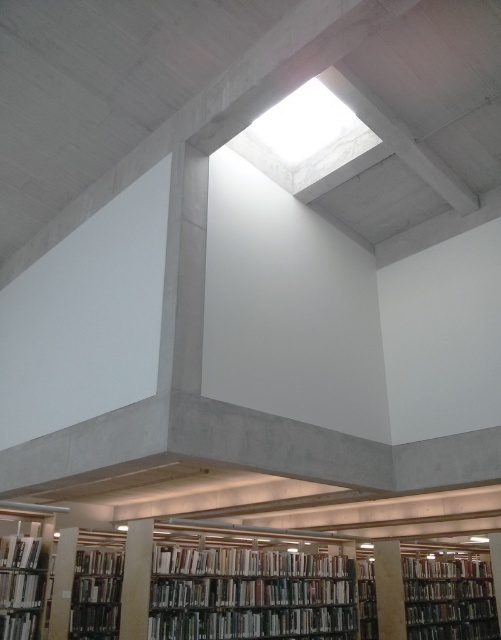
You are a librarian organizing books in the library. You have a hardcover book at lower left and a collection of hardcover books at lower left. How far apart are these two items from each other?

The hardcover book at lower left and the hardcover books at lower left are 5.09 feet apart.

You are a librarian organizing books in the library. You have a wooden bookcase at lower center and a hardcover book at lower left. Can the book fit vertically on the bookcase?

The wooden bookcase at lower center has a lesser height compared to hardcover book at lower left, so the book cannot fit vertically on the bookcase.

In the scene shown: You are standing in the library and want to reach both the wooden bookcase at lower center and the hardcover book at lower left. Which object is closer to you?

The wooden bookcase at lower center is closer to you because it is further to the viewer than the hardcover book at lower left.